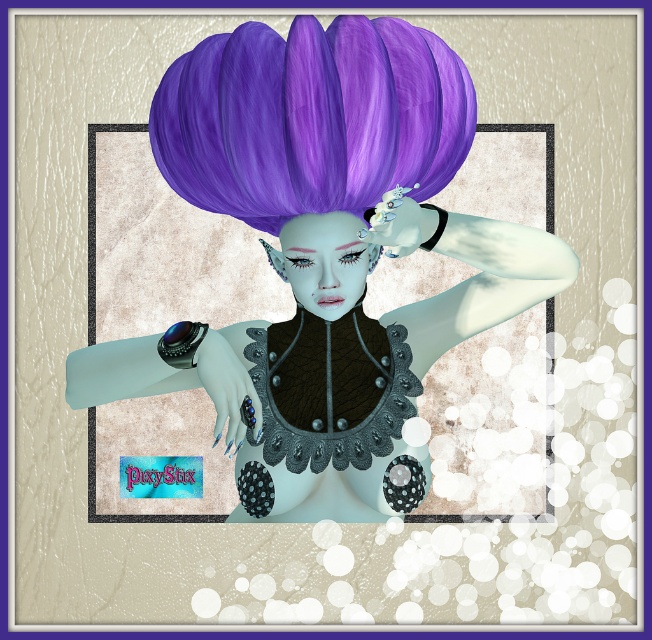
The height and width of the screenshot is (640, 652). I want to click on matte purple wig at upper center, so click(x=303, y=268).

Who is positioned more to the left, matte purple wig at upper center or purple matte wig at upper center?

purple matte wig at upper center is more to the left.

Is point (340, 454) in front of point (246, 216)?

No, it is not.

Identify the location of matte purple wig at upper center. (303, 268).

From the picture: Is matte purple wig at upper center shorter than satin black corset at center?

Incorrect, matte purple wig at upper center's height does not fall short of satin black corset at center's.

Locate an element on the screen. matte purple wig at upper center is located at coordinates (303, 268).

Where is `matte purple wig at upper center`? matte purple wig at upper center is located at coordinates (303, 268).

Can you confirm if purple matte wig at upper center is taller than satin black corset at center?

Indeed, purple matte wig at upper center has a greater height compared to satin black corset at center.

The width and height of the screenshot is (652, 640). I want to click on purple matte wig at upper center, so click(x=312, y=116).